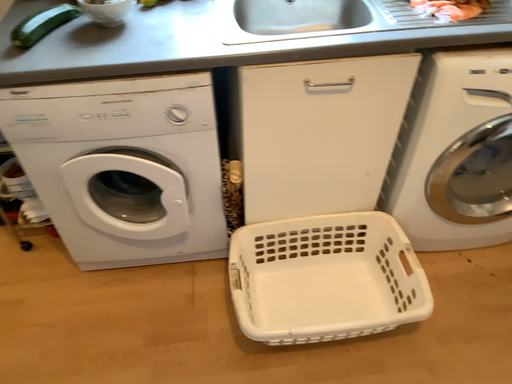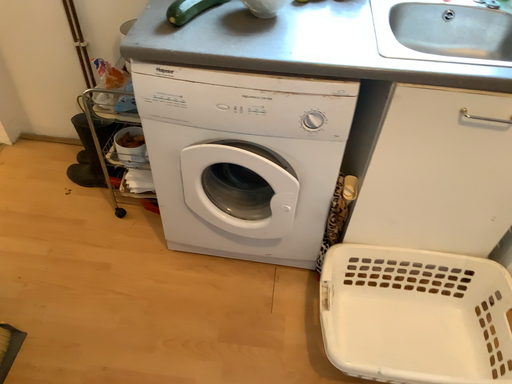
Question: Which way did the camera rotate in the video?

Choices:
 (A) rotated right
 (B) rotated left

Answer: (B)